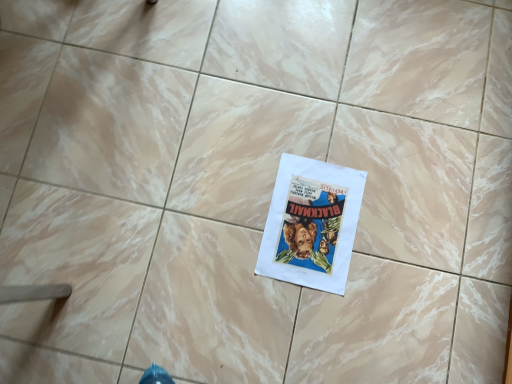
Find the location of `vacant area on the back side of white paper poster at center`. vacant area on the back side of white paper poster at center is located at coordinates (323, 128).